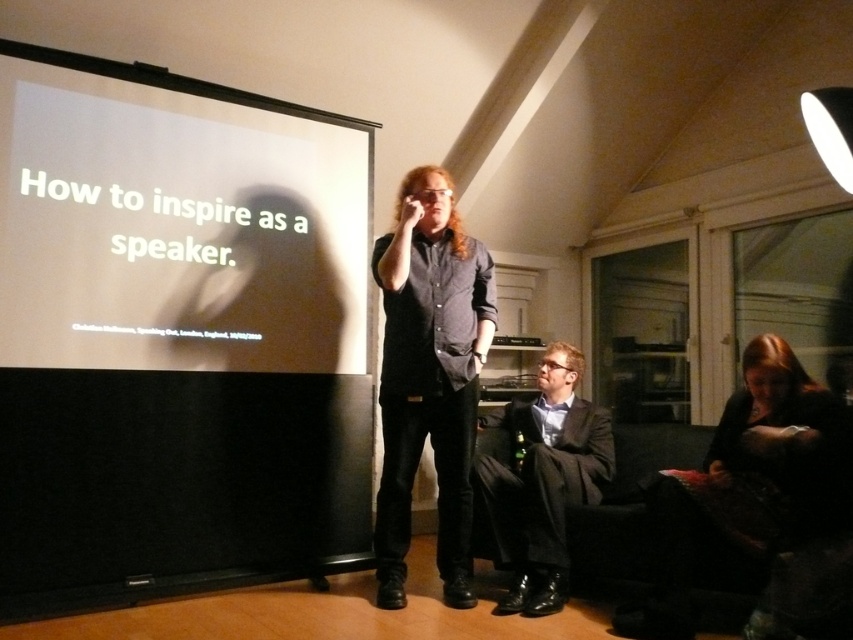
Question: Which object is the farthest from the dark brown leather jacket at lower right?

Choices:
 (A) dark gray shirt at center
 (B) white matte projection screen at upper left

Answer: (B)

Question: Which point appears farthest from the camera in this image?

Choices:
 (A) (833, 412)
 (B) (234, 369)
 (C) (518, 438)

Answer: (C)

Question: Where is white matte projection screen at upper left located in relation to dark gray shirt at center in the image?

Choices:
 (A) left
 (B) right

Answer: (A)

Question: From the image, what is the correct spatial relationship of dark gray shirt at center in relation to dark brown leather jacket at lower right?

Choices:
 (A) above
 (B) below

Answer: (A)

Question: From the image, what is the correct spatial relationship of dark gray shirt at center in relation to dark gray suit at center?

Choices:
 (A) above
 (B) below

Answer: (A)

Question: Which point is farther to the camera?

Choices:
 (A) dark brown leather jacket at lower right
 (B) dark gray shirt at center

Answer: (B)